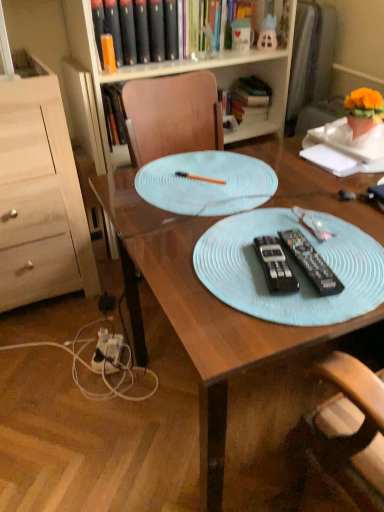
What do you see at coordinates (275, 266) in the screenshot? This screenshot has height=512, width=384. I see `black plastic remote control at center, marked as the second remote control in a right-to-left arrangement` at bounding box center [275, 266].

This screenshot has width=384, height=512. Identify the location of light blue fabric placemat at center. (291, 268).

What is the approximate height of orange plastic pen at center?

It is 1.11 inches.

The image size is (384, 512). Find the location of `orange plastic pen at center`. orange plastic pen at center is located at coordinates (199, 178).

The image size is (384, 512). I want to click on light wood dresser at left, so click(x=39, y=194).

Is white paper at upper right positioned far away from hardcover book at upper center, the second book positioned from the left?

That's not correct — white paper at upper right is a little close to hardcover book at upper center, the second book positioned from the left.

From the image's perspective, which object appears higher, white paper at upper right or hardcover book at upper center, which appears as the first book when viewed from the right?

From the image's view, hardcover book at upper center, which appears as the first book when viewed from the right, is above.

From a real-world perspective, is white paper at upper right physically located above or below hardcover book at upper center, placed as the first book when sorted from back to front?

In terms of real-world spatial position, white paper at upper right is above hardcover book at upper center, placed as the first book when sorted from back to front.

Between point (185, 174) and point (314, 259), which one is positioned behind?

The point (185, 174) is farther.

Between orange plastic pen at center and black plastic remote control at center, the 1th remote control when ordered from right to left, which one is positioned in front?

black plastic remote control at center, the 1th remote control when ordered from right to left.

Is black plastic remote control at center, the 1th remote control when ordered from right to left, at the back of orange plastic pen at center?

No, orange plastic pen at center's orientation is not away from black plastic remote control at center, the 1th remote control when ordered from right to left.

Is orange plastic pen at center next to black plastic remote control at center, the 2th remote control positioned from the left?

There is a gap between orange plastic pen at center and black plastic remote control at center, the 2th remote control positioned from the left.

Relative to orange fabric flower pot at upper right, is black plastic remote control at center, the 2th remote control positioned from the left, in front or behind?

Visually, black plastic remote control at center, the 2th remote control positioned from the left, is located in front of orange fabric flower pot at upper right.

How much distance is there between black plastic remote control at center, the 2th remote control positioned from the left, and orange fabric flower pot at upper right?

A distance of 23.16 inches exists between black plastic remote control at center, the 2th remote control positioned from the left, and orange fabric flower pot at upper right.

Between black plastic remote control at center, the 1th remote control when ordered from right to left, and orange fabric flower pot at upper right, which one has less height?

black plastic remote control at center, the 1th remote control when ordered from right to left.

Considering the sizes of objects black plastic remote control at center, marked as the second remote control in a right-to-left arrangement, and orange fabric flower pot at upper right in the image provided, who is taller, black plastic remote control at center, marked as the second remote control in a right-to-left arrangement, or orange fabric flower pot at upper right?

orange fabric flower pot at upper right.

From a real-world perspective, relative to orange fabric flower pot at upper right, is black plastic remote control at center, which appears as the 1th remote control when viewed from the left, vertically above or below?

Clearly, from a real-world perspective, black plastic remote control at center, which appears as the 1th remote control when viewed from the left, is below orange fabric flower pot at upper right.

Does black plastic remote control at center, marked as the second remote control in a right-to-left arrangement, turn towards orange fabric flower pot at upper right?

No, black plastic remote control at center, marked as the second remote control in a right-to-left arrangement, does not turn towards orange fabric flower pot at upper right.

Locate an element on the screen. houseplant located above the black plastic remote control at center, which appears as the 1th remote control when viewed from the left (from a real-world perspective) is located at coordinates (364, 110).

Is light blue plastic placemat at center not near white plastic power outlet at lower left?

They are positioned close to each other.

Between point (326, 210) and point (115, 361), which one is positioned behind?

Point (115, 361)

Considering the positions of objects light blue plastic placemat at center and white plastic power outlet at lower left in the image provided, who is more to the left, light blue plastic placemat at center or white plastic power outlet at lower left?

white plastic power outlet at lower left is more to the left.

This screenshot has width=384, height=512. What are the coordinates of `desk that is in front of the white plastic power outlet at lower left` in the screenshot? It's located at (198, 314).

Would you say hardcover book at upper center, placed as the first book when sorted from back to front, is inside or outside light blue textured placemat at upper center?

hardcover book at upper center, placed as the first book when sorted from back to front, is located beyond the bounds of light blue textured placemat at upper center.

Is the depth of hardcover book at upper center, placed as the first book when sorted from back to front, greater than that of light blue textured placemat at upper center?

Yes.

Is hardcover book at upper center, placed as the first book when sorted from back to front, facing away from light blue textured placemat at upper center?

That's not correct — hardcover book at upper center, placed as the first book when sorted from back to front, is not looking away from light blue textured placemat at upper center.

Between hardcover book at upper center, marked as the 2th book in a front-to-back arrangement, and light blue textured placemat at upper center, which one has larger width?

light blue textured placemat at upper center.

Can you confirm if white plastic power outlet at lower left is thinner than light blue fabric placemat at center?

Indeed, white plastic power outlet at lower left has a lesser width compared to light blue fabric placemat at center.

Where is `platter that is above the white plastic power outlet at lower left (from a real-world perspective)`? This screenshot has width=384, height=512. platter that is above the white plastic power outlet at lower left (from a real-world perspective) is located at coordinates (291, 268).

In terms of height, does white plastic power outlet at lower left look taller or shorter compared to light blue fabric placemat at center?

In the image, white plastic power outlet at lower left appears to be taller than light blue fabric placemat at center.

Is white plastic power outlet at lower left far away from light blue fabric placemat at center?

No, white plastic power outlet at lower left is not far from light blue fabric placemat at center.

You are a GUI agent. You are given a task and a screenshot of the screen. Output one action in this format:
    pyautogui.click(x=<x>, y=<y>)
    Task: Click on the notepad below the hardcover book at upper center, the second book positioned from the left (from the image's perspective)
    The image size is (384, 512).
    Given the screenshot: What is the action you would take?
    pyautogui.click(x=331, y=160)

Where is `pen on the left of black plastic remote control at center, the 1th remote control when ordered from right to left`? pen on the left of black plastic remote control at center, the 1th remote control when ordered from right to left is located at coordinates (199, 178).

Looking at the image, which one is located further to white paper at upper right, light blue fabric placemat at center or light blue plastic placemat at center?

light blue fabric placemat at center is further to white paper at upper right.

Looking at this image, considering their positions, is black plastic remote control at center, the 2th remote control positioned from the left, positioned further to orange fabric flower pot at upper right than light blue fabric placemat at center?

light blue fabric placemat at center is positioned further to the anchor orange fabric flower pot at upper right.

Looking at the image, which one is located further to white paper at upper right, hardcover book at upper center, which is the first book in left-to-right order, or light blue plastic placemat at center?

Based on the image, hardcover book at upper center, which is the first book in left-to-right order, appears to be further to white paper at upper right.

When comparing their distances from light blue plastic placemat at center, does black plastic remote control at center, the 2th remote control positioned from the left, or light blue fabric placemat at center seem closer?

light blue fabric placemat at center is positioned closer to the anchor light blue plastic placemat at center.

Looking at the image, which one is located further to light blue plastic placemat at center, light blue textured placemat at upper center or light blue fabric placemat at center?

The object further to light blue plastic placemat at center is light blue textured placemat at upper center.

Estimate the real-world distances between objects in this image. Which object is closer to white paper at upper right, light blue fabric placemat at center or hardcover book at upper center, which is the 2th book in right-to-left order?

Among the two, light blue fabric placemat at center is located nearer to white paper at upper right.

Which object lies nearer to the anchor point orange fabric flower pot at upper right, black plastic remote control at center, which appears as the 1th remote control when viewed from the left, or hardcover book at upper center, the 1th book in the front-to-back sequence?

black plastic remote control at center, which appears as the 1th remote control when viewed from the left, is positioned closer to the anchor orange fabric flower pot at upper right.

Which object lies further to the anchor point black plastic remote control at center, which appears as the 1th remote control when viewed from the left, black plastic remote control at center, the 2th remote control positioned from the left, or orange plastic pen at center?

orange plastic pen at center is further to black plastic remote control at center, which appears as the 1th remote control when viewed from the left.

Where is `houseplant that lies between hardcover book at upper center, the 1th book in the front-to-back sequence, and light blue fabric placemat at center from top to bottom`? houseplant that lies between hardcover book at upper center, the 1th book in the front-to-back sequence, and light blue fabric placemat at center from top to bottom is located at coordinates (364, 110).

You are a GUI agent. You are given a task and a screenshot of the screen. Output one action in this format:
    pyautogui.click(x=<x>, y=<y>)
    Task: Click on the glass plate between wooden bookcase at upper center and orange plastic pen at center vertically
    The image size is (384, 512).
    Given the screenshot: What is the action you would take?
    pyautogui.click(x=206, y=183)

What are the coordinates of `glass plate between light wood dresser at left and black plastic remote control at center, which appears as the 1th remote control when viewed from the left, from left to right` in the screenshot? It's located at (206, 183).

Find the location of a particular element. The image size is (384, 512). notepad positioned between orange plastic pen at center and hardcover book at upper center, which appears as the first book when viewed from the right, from near to far is located at coordinates (331, 160).